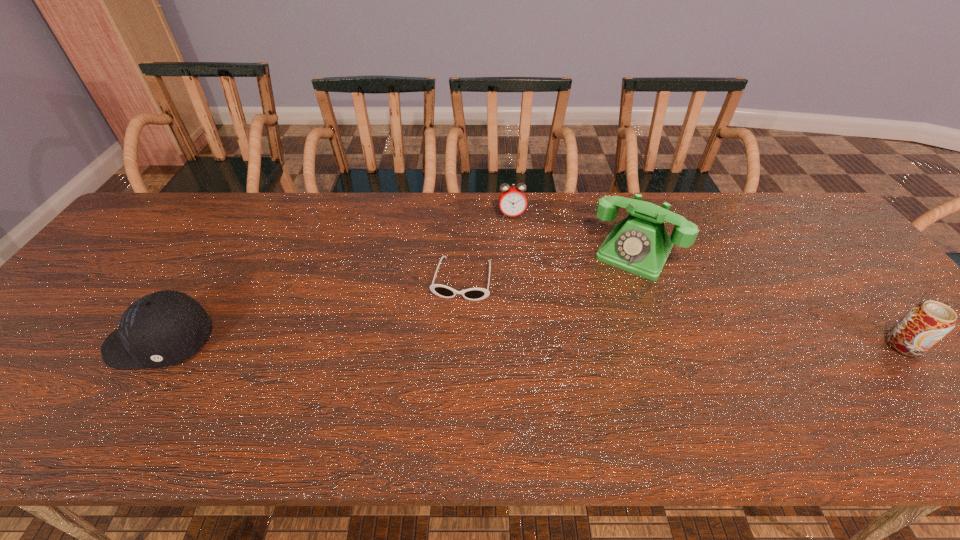
Identify the location of vacant spot on the desktop that is between the leftmost object and the beer can and is positioned with the lenses of the fourth object from right to left facing outward. (447, 343).

I want to click on vacant space on the desktop that is between the leftmost object and the beer can and is positioned on the front-facing side of the third object from left to right, so click(532, 344).

Image resolution: width=960 pixels, height=540 pixels. In order to click on free space on the desktop that is between the leftmost object and the beer can and is positioned on the dial of the tallest object in this screenshot , I will do `click(583, 344)`.